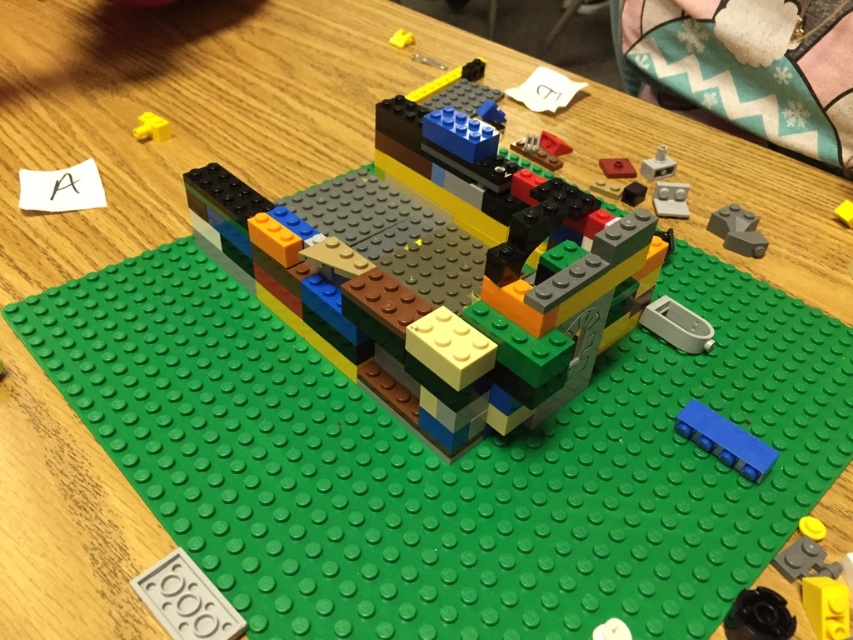
Between matte red brick at center and yellow plastic piece at upper center, which one is positioned lower?

matte red brick at center

Looking at this image, is matte red brick at center shorter than yellow plastic piece at upper center?

Yes, matte red brick at center is shorter than yellow plastic piece at upper center.

Where is `matte red brick at center`? matte red brick at center is located at coordinates (616, 168).

Is matte gray gear at upper right shorter than yellow plastic piece at upper center?

No.

Who is lower down, matte gray gear at upper right or yellow plastic piece at upper center?

matte gray gear at upper right is below.

This screenshot has height=640, width=853. Find the location of `matte gray gear at upper right`. matte gray gear at upper right is located at coordinates (737, 230).

Who is more forward, (x=671, y=193) or (x=405, y=29)?

Point (x=671, y=193) is more forward.

Where is `matte gray bricks at upper right`? Image resolution: width=853 pixels, height=640 pixels. matte gray bricks at upper right is located at coordinates (670, 198).